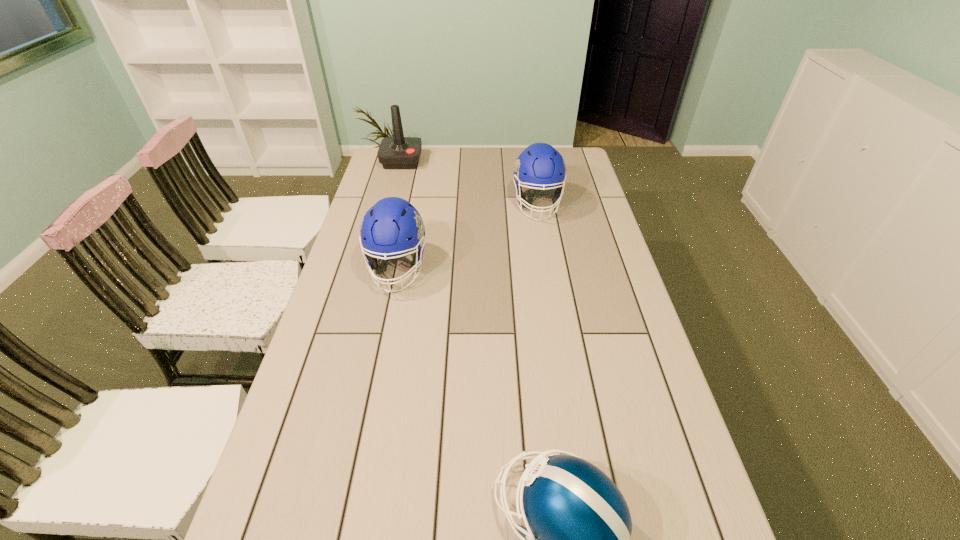
Find the location of `object that is positioned at the right edge`. object that is positioned at the right edge is located at coordinates (540, 166).

Image resolution: width=960 pixels, height=540 pixels. Identify the location of object located in the far left corner section of the desktop. (398, 152).

You are a GUI agent. You are given a task and a screenshot of the screen. Output one action in this format:
    pyautogui.click(x=<x>, y=<y>)
    Task: Click on the free space at the far edge
    This screenshot has width=960, height=540.
    Given the screenshot: What is the action you would take?
    pyautogui.click(x=481, y=153)

Where is `free space at the left edge`? The image size is (960, 540). free space at the left edge is located at coordinates (372, 179).

What are the coordinates of `free space at the right edge of the desktop` in the screenshot? It's located at (612, 441).

I want to click on empty location between the leftmost football helmet and the farthest football helmet, so click(468, 236).

Where is `object that is the third closest to the second farthest object`? The image size is (960, 540). object that is the third closest to the second farthest object is located at coordinates (575, 539).

Choose which object is the nearest neighbor to the nearest football helmet. Please provide its 2D coordinates. Your answer should be formatted as a tuple, i.e. [(x, y)], where the tuple contains the x and y coordinates of a point satisfying the conditions above.

[(386, 226)]

Locate an element on the screen. This screenshot has width=960, height=540. football helmet that is the second nearest to the farthest object is located at coordinates (386, 226).

Locate an element on the screen. football helmet that is the nearest to the second nearest football helmet is located at coordinates click(x=540, y=166).